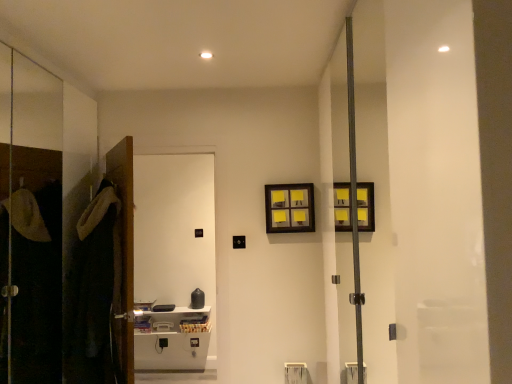
Question: From a real-world perspective, is white glossy cabinet at left under wooden picture frame at upper center?

Choices:
 (A) yes
 (B) no

Answer: (A)

Question: Does white glossy cabinet at left appear on the right side of wooden picture frame at upper center?

Choices:
 (A) yes
 (B) no

Answer: (B)

Question: From a real-world perspective, is white glossy cabinet at left on top of wooden picture frame at upper center?

Choices:
 (A) no
 (B) yes

Answer: (A)

Question: Are white glossy cabinet at left and wooden picture frame at upper center beside each other?

Choices:
 (A) yes
 (B) no

Answer: (B)

Question: Considering the relative positions of white glossy cabinet at left and wooden picture frame at upper center in the image provided, is white glossy cabinet at left to the left of wooden picture frame at upper center from the viewer's perspective?

Choices:
 (A) yes
 (B) no

Answer: (A)

Question: In terms of height, does white glossy cabinet at left look taller or shorter compared to dark brown plush robe at left?

Choices:
 (A) short
 (B) tall

Answer: (B)

Question: From the image's perspective, is white glossy cabinet at left located above or below dark brown plush robe at left?

Choices:
 (A) above
 (B) below

Answer: (A)

Question: Is white glossy cabinet at left in front of or behind dark brown plush robe at left in the image?

Choices:
 (A) front
 (B) behind

Answer: (B)

Question: Looking at the image, does white glossy cabinet at left seem bigger or smaller compared to dark brown plush robe at left?

Choices:
 (A) big
 (B) small

Answer: (A)

Question: Considering the positions of brown wooden door at left and white glossy cabinet at left in the image, is brown wooden door at left taller or shorter than white glossy cabinet at left?

Choices:
 (A) tall
 (B) short

Answer: (B)

Question: Do you think brown wooden door at left is within white glossy cabinet at left, or outside of it?

Choices:
 (A) inside
 (B) outside

Answer: (B)

Question: Visually, is brown wooden door at left positioned to the left or to the right of white glossy cabinet at left?

Choices:
 (A) left
 (B) right

Answer: (A)

Question: Relative to white glossy cabinet at left, is brown wooden door at left in front or behind?

Choices:
 (A) front
 (B) behind

Answer: (A)

Question: Is point (272, 203) positioned closer to the camera than point (91, 288)?

Choices:
 (A) farther
 (B) closer

Answer: (A)

Question: Considering the positions of wooden picture frame at upper center and dark brown plush robe at left in the image, is wooden picture frame at upper center bigger or smaller than dark brown plush robe at left?

Choices:
 (A) small
 (B) big

Answer: (A)